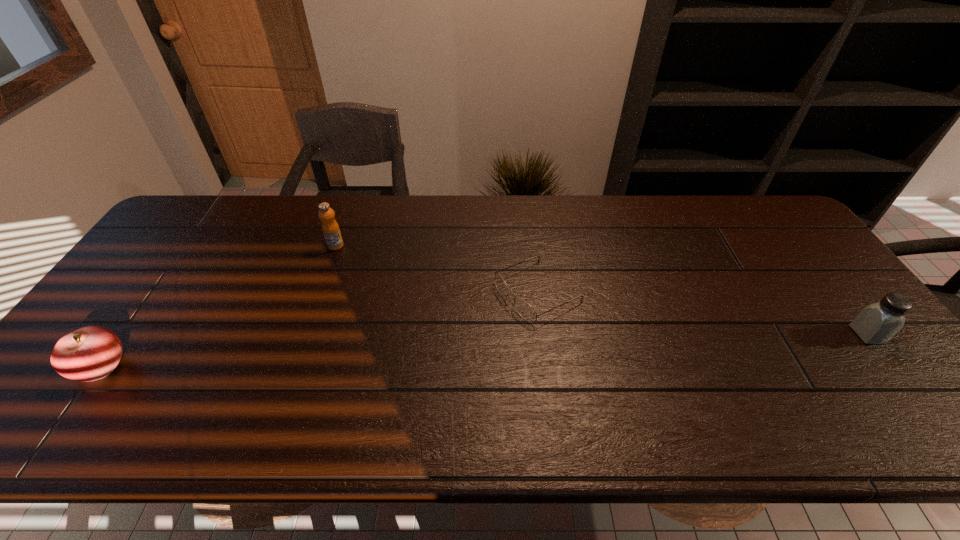
This screenshot has height=540, width=960. What are the coordinates of `vacant space at the left edge of the desktop` in the screenshot? It's located at pyautogui.click(x=152, y=252).

Find the location of a particular element. This screenshot has width=960, height=540. vacant space at the right edge is located at coordinates (803, 303).

This screenshot has width=960, height=540. What are the coordinates of `vacant region at the far right corner of the desktop` in the screenshot? It's located at coord(748,201).

The height and width of the screenshot is (540, 960). Find the location of `vacant area between the shortest object and the leftmost object`. vacant area between the shortest object and the leftmost object is located at coordinates (319, 328).

Locate an element on the screen. blank region between the spectacles and the leftmost object is located at coordinates (319, 328).

Identify the location of free space between the saltshaker and the apple. (484, 350).

Locate an element on the screen. This screenshot has height=540, width=960. free spot between the rightmost object and the spectacles is located at coordinates (703, 313).

At what (x,y) coordinates should I click in order to perform the action: click on vacant point located between the saltshaker and the third object from left to right. Please return your answer as a coordinate pair (x, y). Image resolution: width=960 pixels, height=540 pixels. Looking at the image, I should click on (703, 313).

Image resolution: width=960 pixels, height=540 pixels. Find the location of `vacant area that lies between the third object from left to right and the third object from right to left`. vacant area that lies between the third object from left to right and the third object from right to left is located at coordinates (437, 268).

You are a GUI agent. You are given a task and a screenshot of the screen. Output one action in this format:
    pyautogui.click(x=<x>, y=<y>)
    Task: Click on the vacant area between the leftmost object and the third object from left to right
    Image resolution: width=960 pixels, height=540 pixels.
    Given the screenshot: What is the action you would take?
    pyautogui.click(x=319, y=328)